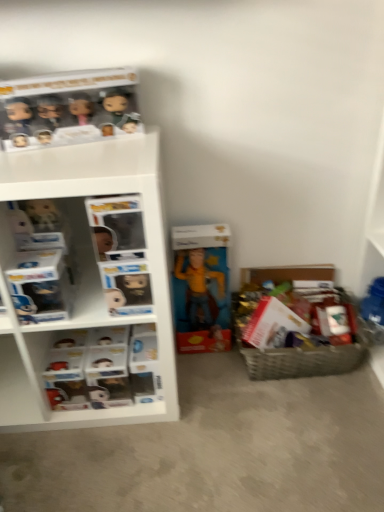
Where is `vacant area that is situated to the right of white plastic shelves at left`? vacant area that is situated to the right of white plastic shelves at left is located at coordinates point(210,390).